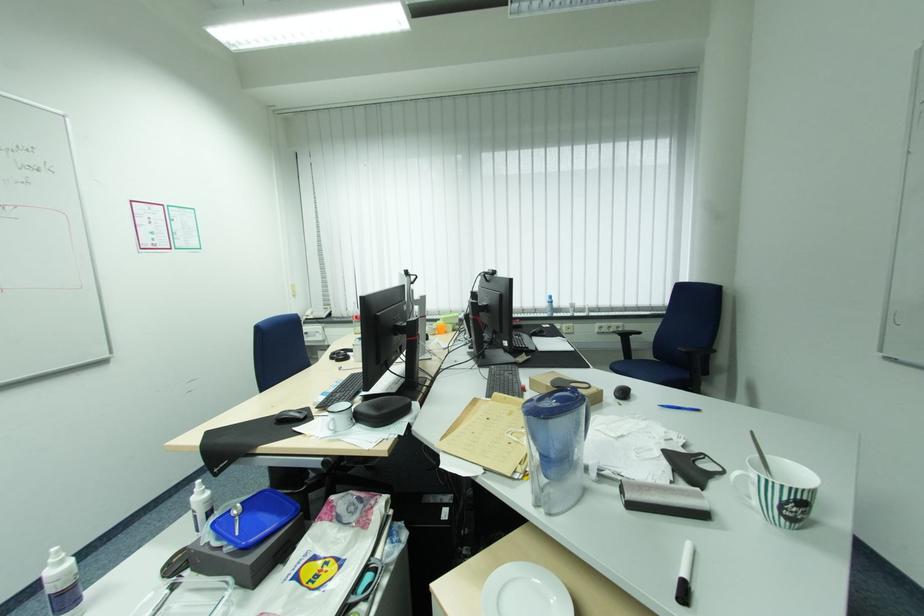
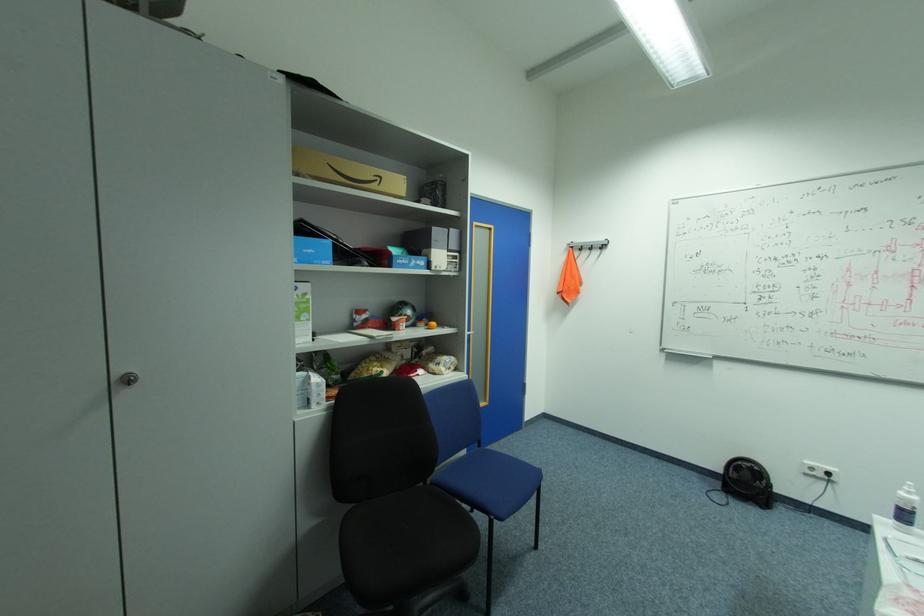
Find the pixel in the second image that matches pixel 68 562 in the first image.

(916, 493)